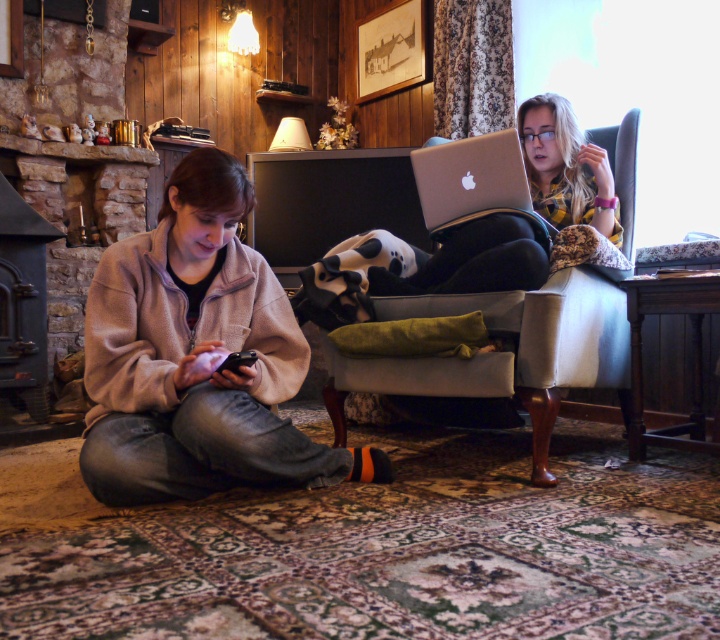
You are planning to pack a small backpack for a short trip. You have both the beige fleece jacket at lower left and the silver metallic laptop at upper right. Which item should you pack first to ensure it fits properly?

You should pack the beige fleece jacket at lower left first because it has a larger size compared to the silver metallic laptop at upper right, so placing the larger item first ensures proper fitting in the backpack.

You are trying to place a rectangular box that is 1.2 meters wide on the floor between the beige fleece jacket at lower left and the silver metallic laptop at upper right. Based on their positions, can the box fit horizontally between them?

The beige fleece jacket at lower left might be wider than the silver metallic laptop at upper right, but without exact measurements of the space between them, it is uncertain if the 1.2 meter wide box can fit horizontally. Additional information about the distance between the two objects is needed to determine feasibility.